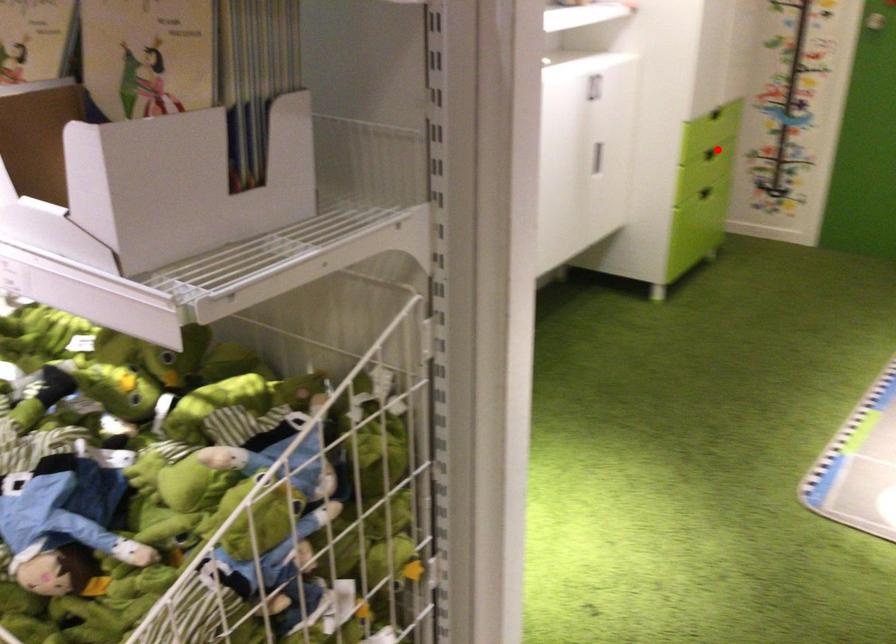
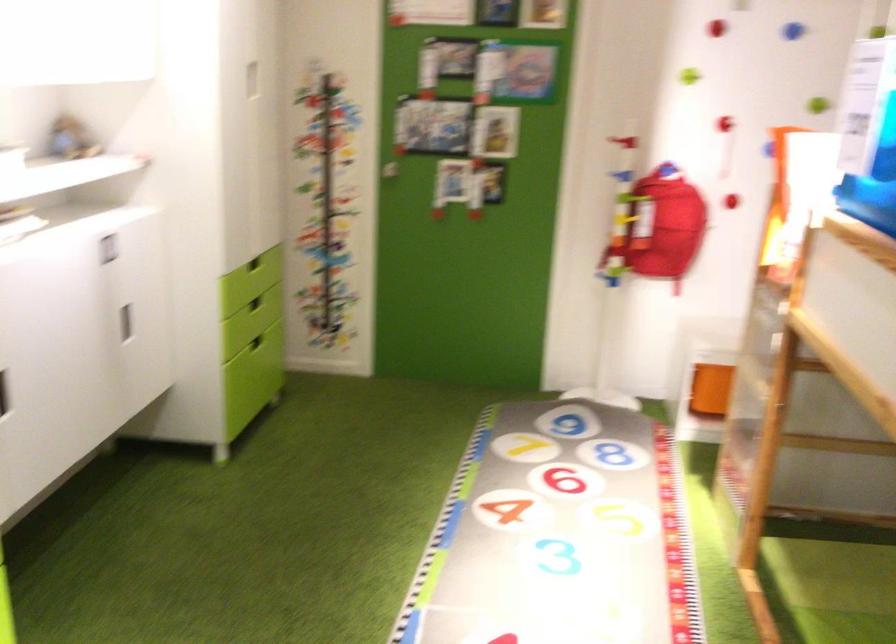
The point at the highlighted location is marked in the first image. Where is the corresponding point in the second image?

(254, 303)